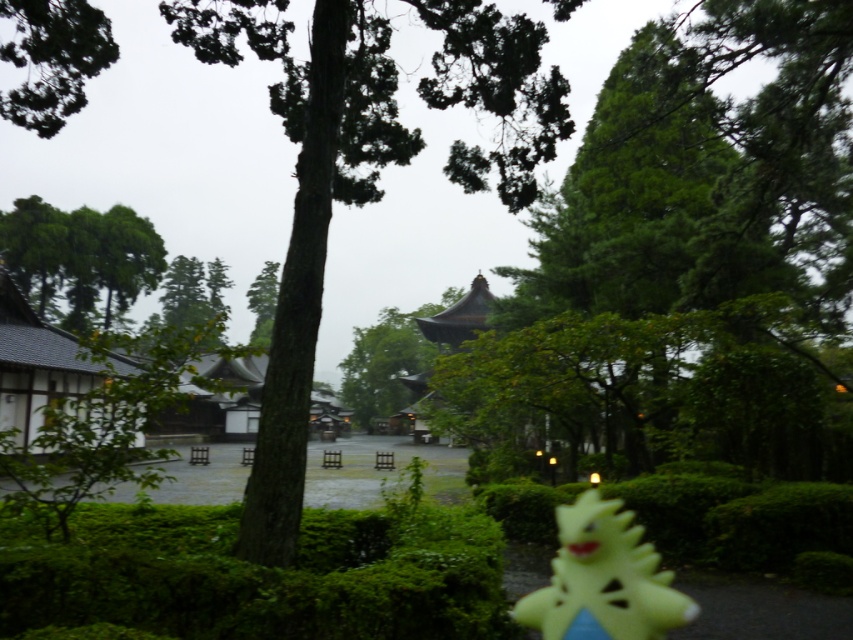
Question: Which object is positioned closest to the yellow rubber duck at lower right?

Choices:
 (A) green mossy hedge at lower left
 (B) green leafy tree at center

Answer: (A)

Question: Among these objects, which one is farthest from the camera?

Choices:
 (A) yellow rubber duck at lower right
 (B) green mossy hedge at lower left

Answer: (A)

Question: Is the position of green mossy hedge at lower left less distant than that of yellow rubber duck at lower right?

Choices:
 (A) yes
 (B) no

Answer: (A)

Question: Does green mossy hedge at lower left have a smaller size compared to yellow rubber duck at lower right?

Choices:
 (A) no
 (B) yes

Answer: (A)

Question: Can you confirm if green mossy hedge at lower left is bigger than yellow rubber duck at lower right?

Choices:
 (A) yes
 (B) no

Answer: (A)

Question: Which point is farther to the camera?

Choices:
 (A) (579, 502)
 (B) (126, 529)
 (C) (416, 129)

Answer: (C)